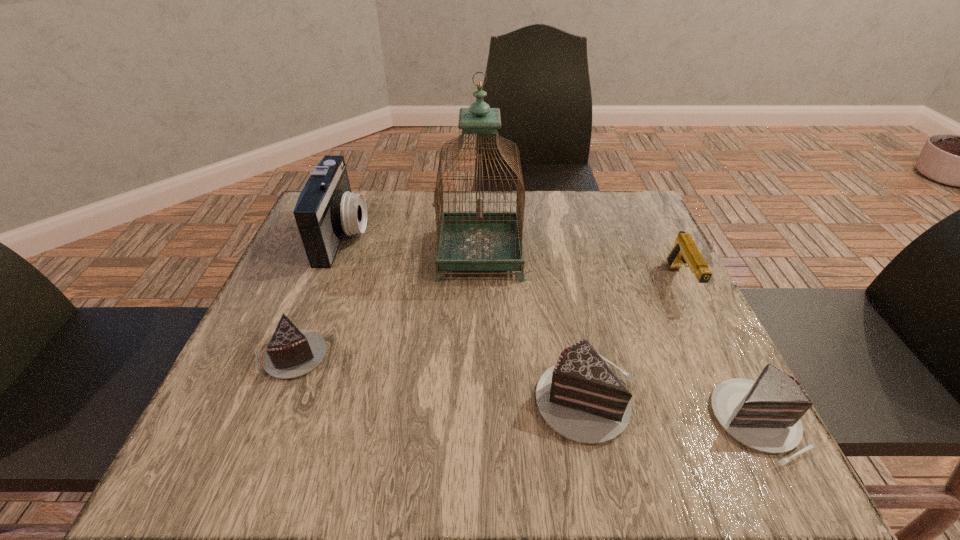
Identify the location of blank space that satisfies the following two spatial constraints: 1. at the barrel of the pistol; 2. on the left side of the rightmost chocolate cake. (749, 422).